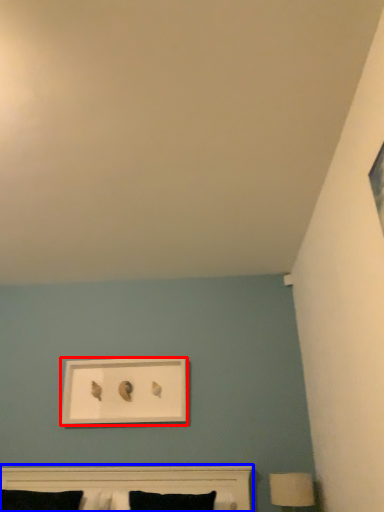
Question: Which of the following is the closest to the observer, picture frame (highlighted by a red box) or bed (highlighted by a blue box)?

Choices:
 (A) picture frame
 (B) bed

Answer: (B)